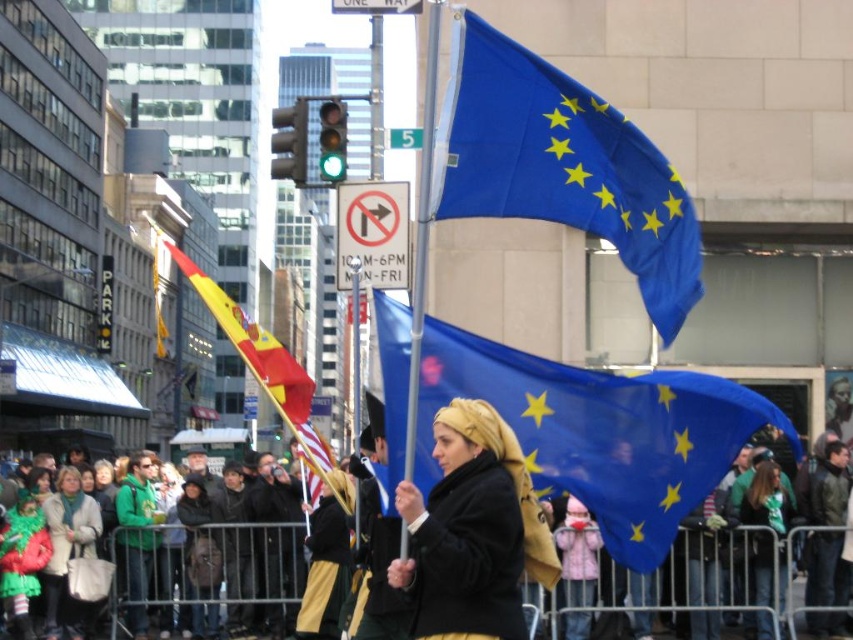
Question: Which object is positioned farthest from the blue fabric flag at center?

Choices:
 (A) black matte coat at center
 (B) yellow-red fabric flag at center-left

Answer: (B)

Question: Is blue fabric flag at upper center thinner than black jacket at center?

Choices:
 (A) no
 (B) yes

Answer: (B)

Question: Can you confirm if blue fabric flag at center is bigger than green wool scarf at lower left?

Choices:
 (A) no
 (B) yes

Answer: (B)

Question: Among these points, which one is nearest to the camera?

Choices:
 (A) (296, 492)
 (B) (621, 566)

Answer: (B)

Question: Can you confirm if blue fabric flag at center is wider than black matte coat at center?

Choices:
 (A) yes
 (B) no

Answer: (A)

Question: Which point is closer to the camera?

Choices:
 (A) (503, 588)
 (B) (302, 420)

Answer: (A)